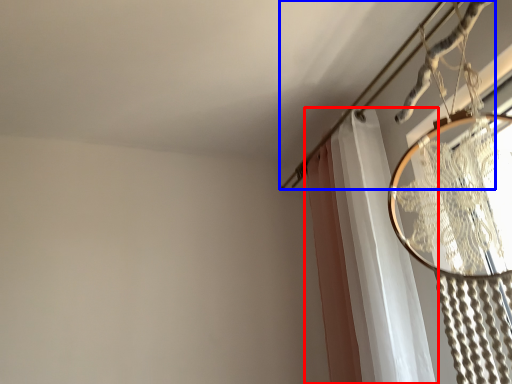
Question: Which of the following is the farthest to the observer, curtain (highlighted by a red box) or clothesline (highlighted by a blue box)?

Choices:
 (A) curtain
 (B) clothesline

Answer: (A)